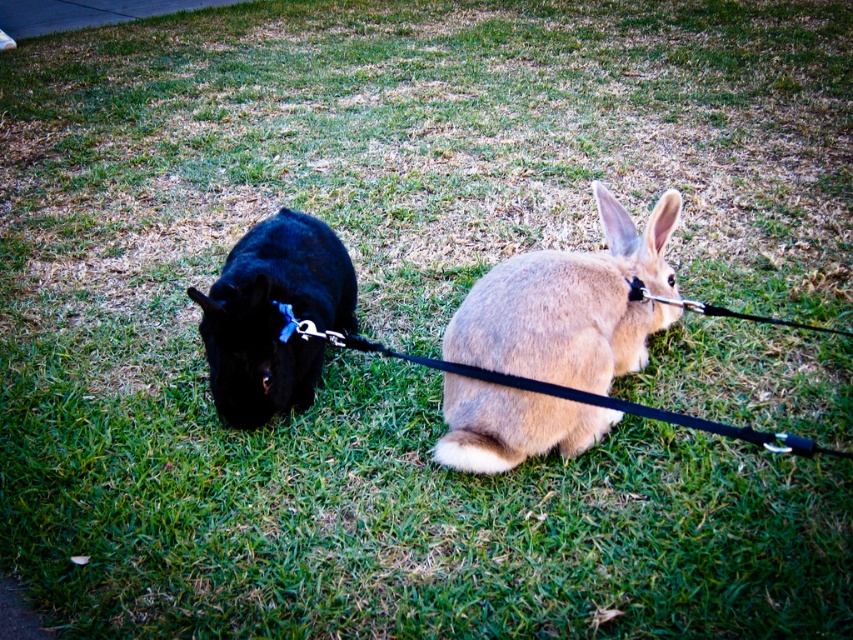
This screenshot has width=853, height=640. What do you see at coordinates (572, 305) in the screenshot?
I see `fuzzy beige rabbit at center` at bounding box center [572, 305].

Is fuzzy beige rabbit at center wider than black leather leash at center?

No, fuzzy beige rabbit at center is not wider than black leather leash at center.

Between point (560, 262) and point (358, 346), which one is positioned behind?

Point (560, 262)

I want to click on fuzzy beige rabbit at center, so click(572, 305).

Can you confirm if fuzzy beige rabbit at center is positioned above shiny black rabbit at left?

Actually, fuzzy beige rabbit at center is below shiny black rabbit at left.

In order to click on fuzzy beige rabbit at center in this screenshot , I will do [x=572, y=305].

Locate an element on the screen. fuzzy beige rabbit at center is located at coordinates (572, 305).

Between point (251, 378) and point (483, 378), which one is positioned in front?

Point (483, 378) is more forward.

Does shiny black rabbit at left appear over black leather leash at center?

Yes.

Does point (273, 316) lie in front of point (450, 364)?

No.

This screenshot has width=853, height=640. I want to click on shiny black rabbit at left, so click(x=273, y=316).